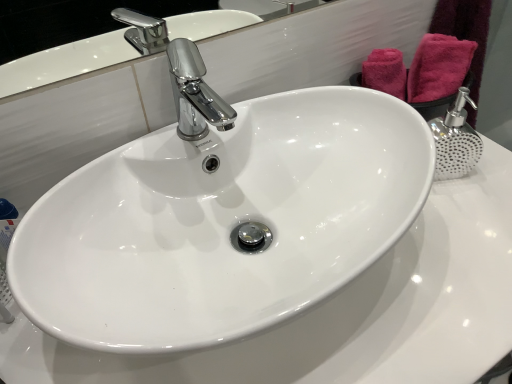
Question: Is pink fabric towel at upper right thinner than white glossy sink at center?

Choices:
 (A) yes
 (B) no

Answer: (A)

Question: From the image's perspective, is pink fabric towel at upper right below white glossy sink at center?

Choices:
 (A) yes
 (B) no

Answer: (B)

Question: Does pink fabric towel at upper right have a lesser height compared to white glossy sink at center?

Choices:
 (A) yes
 (B) no

Answer: (A)

Question: Can you confirm if pink fabric towel at upper right is wider than white glossy sink at center?

Choices:
 (A) no
 (B) yes

Answer: (A)

Question: Is pink fabric towel at upper right in front of white glossy sink at center?

Choices:
 (A) yes
 (B) no

Answer: (B)

Question: Is pink fabric towel at upper right located outside white glossy sink at center?

Choices:
 (A) yes
 (B) no

Answer: (A)

Question: Is white glossy sink at center at the left side of pink fabric towel at upper right?

Choices:
 (A) no
 (B) yes

Answer: (B)

Question: Does white glossy sink at center have a greater height compared to pink fabric towel at upper right?

Choices:
 (A) yes
 (B) no

Answer: (A)

Question: Does white glossy sink at center have a lesser width compared to pink fabric towel at upper right?

Choices:
 (A) no
 (B) yes

Answer: (A)

Question: Is white glossy sink at center outside of pink fabric towel at upper right?

Choices:
 (A) no
 (B) yes

Answer: (B)

Question: From a real-world perspective, is white glossy sink at center over pink fabric towel at upper right?

Choices:
 (A) no
 (B) yes

Answer: (A)

Question: From a real-world perspective, is white glossy sink at center beneath pink fabric towel at upper right?

Choices:
 (A) no
 (B) yes

Answer: (B)

Question: In the image, is white glossy sink at center positioned in front of or behind pink fabric towel at upper right?

Choices:
 (A) front
 (B) behind

Answer: (A)